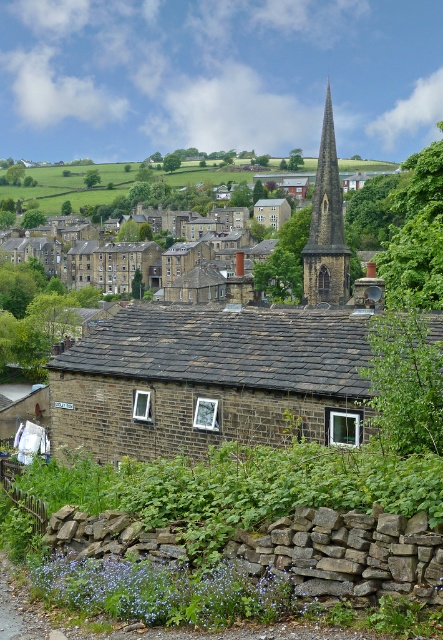
You are an architect planning to add a new structure between the brown stone church at center and the dark gray stone spire at center. Given their widths, which one should the new structure be placed closer to to ensure it doesn

The brown stone church at center has a lesser width compared to the dark gray stone spire at center, so the new structure should be placed closer to the brown stone church at center to maintain balance between the two structures.

You are standing in the village square and want to take a photo of the brown stone church at center. If your camera can focus on objects up to 15 meters away, will you need to move closer to capture a clear image?

The brown stone church at center is 16.82 meters away from the viewer. Since the camera can only focus up to 15 meters, you need to move closer to ensure the church is within the camera range.